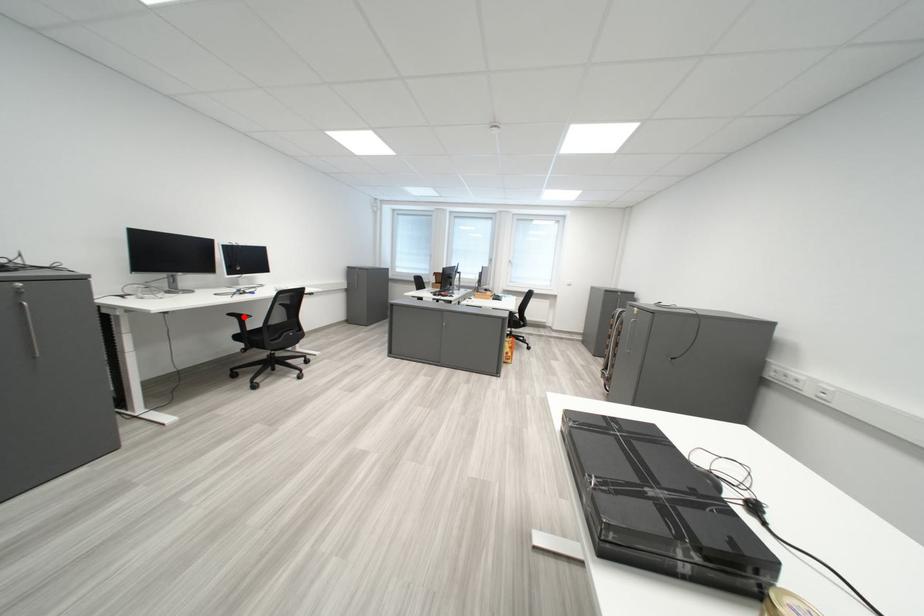
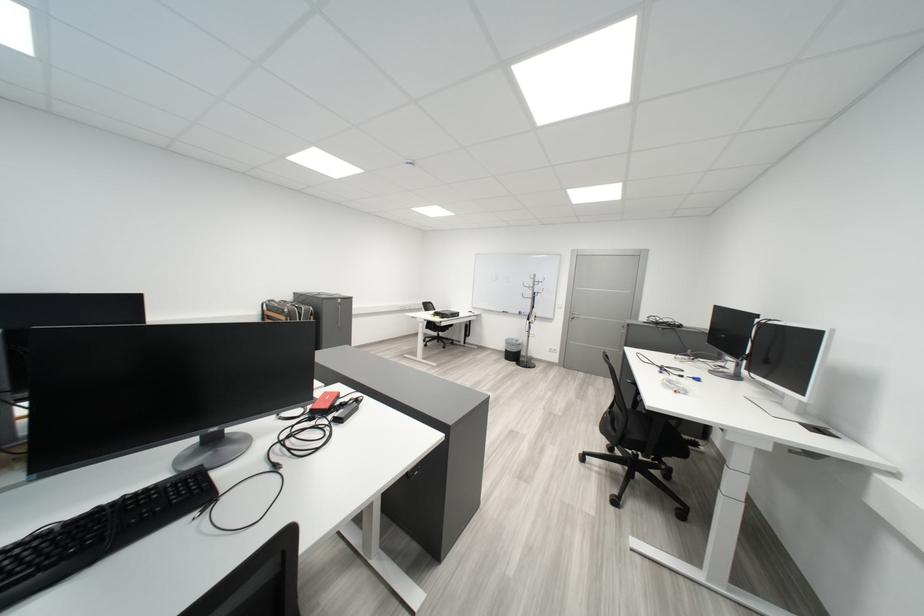
Question: I am providing you with two images of the same scene from different viewpoints. A red point is marked on the first image. Can you still see the location of the red point in image 2?

Choices:
 (A) Yes
 (B) No

Answer: (B)